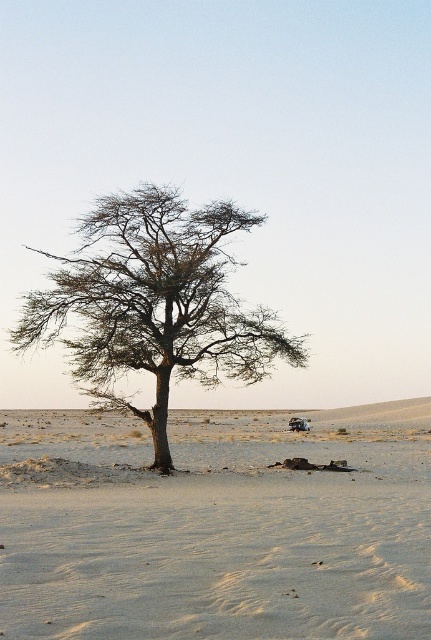
Question: Observing the image, what is the correct spatial positioning of sandy beige sand at center in reference to brown textured tree at center?

Choices:
 (A) below
 (B) above

Answer: (A)

Question: Does sandy beige sand at center appear over brown textured tree at center?

Choices:
 (A) no
 (B) yes

Answer: (A)

Question: Which point appears closest to the camera in this image?

Choices:
 (A) (108, 205)
 (B) (13, 620)

Answer: (B)

Question: Which point is closer to the camera?

Choices:
 (A) (87, 237)
 (B) (127, 595)

Answer: (B)

Question: Is the position of sandy beige sand at center less distant than that of brown textured tree at center?

Choices:
 (A) no
 (B) yes

Answer: (B)